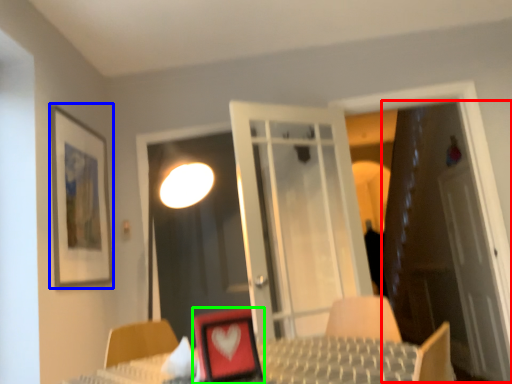
Question: Which object is the closest to the door (highlighted by a red box)? Choose among these: picture frame (highlighted by a blue box) or picture frame (highlighted by a green box).

Choices:
 (A) picture frame
 (B) picture frame

Answer: (A)